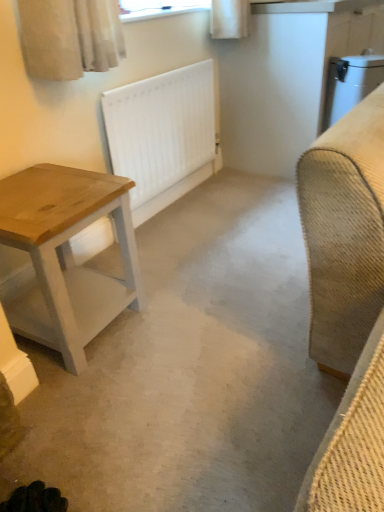
Question: Should I look upward or downward to see wooden table at left?

Choices:
 (A) down
 (B) up

Answer: (A)

Question: Is white matte radiator at center positioned before white matte concrete at center?

Choices:
 (A) yes
 (B) no

Answer: (B)

Question: From a real-world perspective, does white matte radiator at center stand above white matte concrete at center?

Choices:
 (A) no
 (B) yes

Answer: (B)

Question: Is white matte radiator at center looking in the opposite direction of white matte concrete at center?

Choices:
 (A) no
 (B) yes

Answer: (A)

Question: Is white matte radiator at center taller than white matte concrete at center?

Choices:
 (A) no
 (B) yes

Answer: (B)

Question: Would you say white matte concrete at center is part of white matte radiator at center's contents?

Choices:
 (A) yes
 (B) no

Answer: (B)

Question: From the image's perspective, would you say white matte radiator at center is positioned over white matte concrete at center?

Choices:
 (A) no
 (B) yes

Answer: (B)

Question: Does white matte concrete at center lie behind white matte radiator at center?

Choices:
 (A) no
 (B) yes

Answer: (A)

Question: Can you confirm if white matte concrete at center is wider than white matte radiator at center?

Choices:
 (A) no
 (B) yes

Answer: (B)

Question: Can you confirm if white matte concrete at center is taller than white matte radiator at center?

Choices:
 (A) yes
 (B) no

Answer: (B)

Question: Considering the relative sizes of white matte concrete at center and white matte radiator at center in the image provided, is white matte concrete at center thinner than white matte radiator at center?

Choices:
 (A) yes
 (B) no

Answer: (B)

Question: Considering the relative positions of white matte concrete at center and white matte radiator at center in the image provided, is white matte concrete at center to the left of white matte radiator at center from the viewer's perspective?

Choices:
 (A) yes
 (B) no

Answer: (B)

Question: Is white matte radiator at center located within white matte concrete at center?

Choices:
 (A) yes
 (B) no

Answer: (B)

Question: Is white matte radiator at center located outside wooden table at left?

Choices:
 (A) no
 (B) yes

Answer: (B)